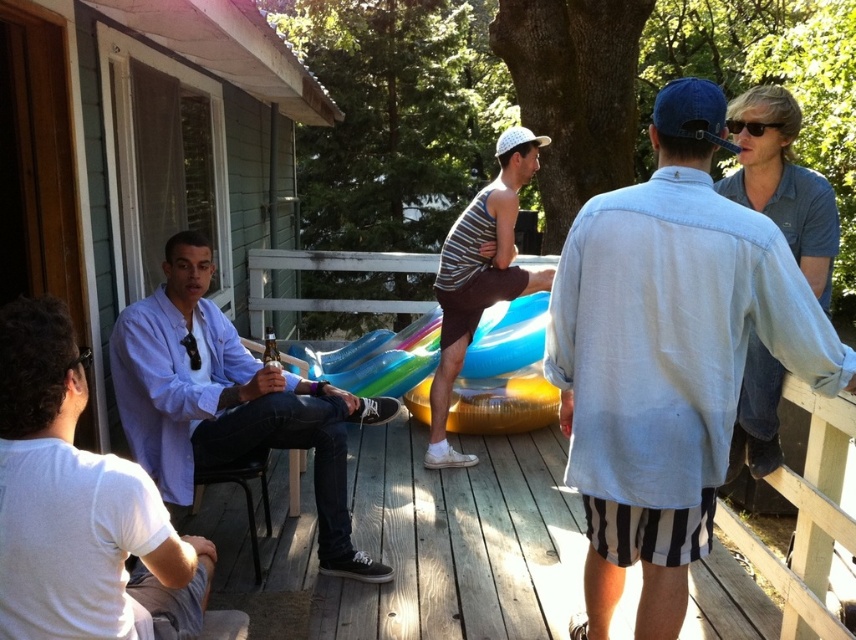
Can you confirm if denim shirt at upper right is positioned above white cotton shirt at left?

Yes, denim shirt at upper right is above white cotton shirt at left.

Can you confirm if denim shirt at upper right is smaller than white cotton shirt at left?

No, denim shirt at upper right is not smaller than white cotton shirt at left.

Between point (617, 563) and point (1, 461), which one is positioned behind?

The point (617, 563) is more distant.

Identify the location of denim shirt at upper right. The image size is (856, 640). (669, 356).

Is point (712, 106) less distant than point (795, 225)?

Yes, it is.

Does denim shirt at upper right have a greater height compared to blue denim shirt at upper right?

Yes.

Identify the location of denim shirt at upper right. (669, 356).

Who is positioned more to the right, white cotton shirt at left or blue denim shirt at upper right?

From the viewer's perspective, blue denim shirt at upper right appears more on the right side.

Which is more to the left, white cotton shirt at left or blue denim shirt at upper right?

Positioned to the left is white cotton shirt at left.

Is point (18, 570) behind point (797, 248)?

That is False.

Image resolution: width=856 pixels, height=640 pixels. Find the location of `white cotton shirt at left`. white cotton shirt at left is located at coordinates (79, 506).